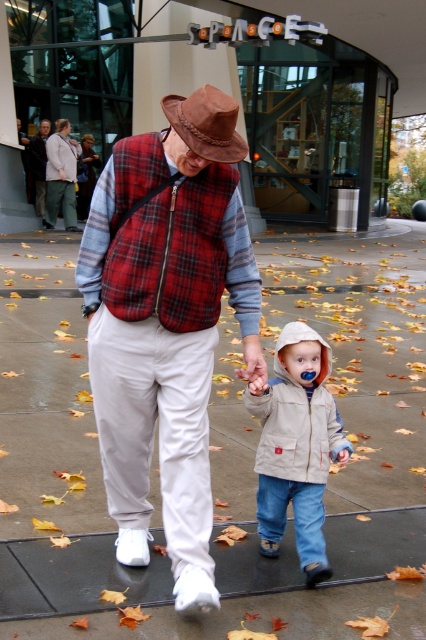
You are standing at the point marked as point (362, 348). What type of surface are you currently standing on?

The surface at point (362, 348) is concrete pavement.

You are planning to place a 3 meter long bench between the concrete pavement at center and the brown leather fedora at center. Will the bench fit between them?

The distance between the concrete pavement at center and the brown leather fedora at center is 5.09 meters. Since the bench is 3 meters long, it will fit between them with 2.09 meters of space remaining.

You are standing on the concrete pavement at center and want to hand something to the person wearing the plaid fabric vest at center. In which direction should you move to reach them?

The concrete pavement at center is positioned on the right side of the plaid fabric vest at center, so you should move to your left to reach them.